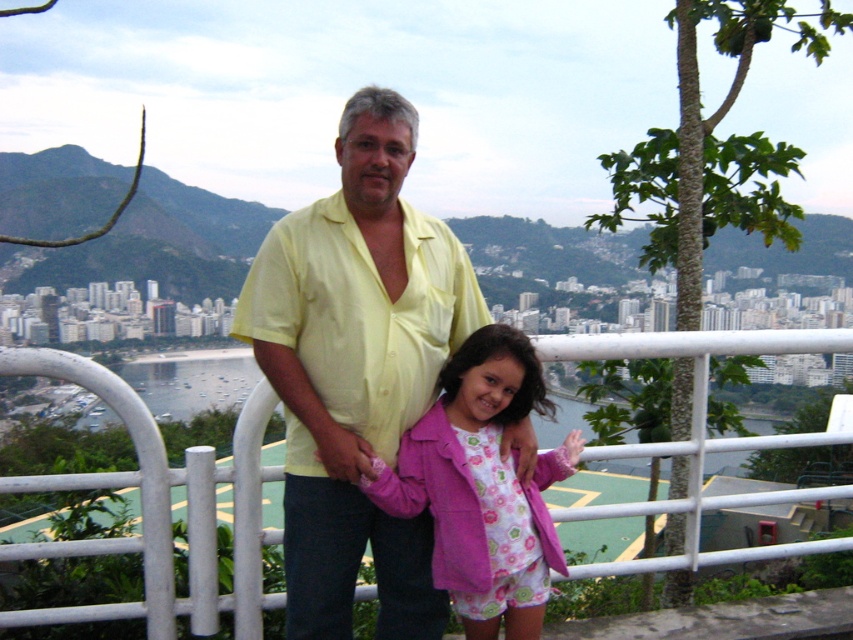
Question: Which object is farther from the camera taking this photo?

Choices:
 (A) white metal fence at center
 (B) pink fabric jacket at center

Answer: (B)

Question: Is yellow smooth shirt at center above white metal fence at center?

Choices:
 (A) no
 (B) yes

Answer: (B)

Question: Is white metal fence at center to the right of pink fabric jacket at center from the viewer's perspective?

Choices:
 (A) yes
 (B) no

Answer: (B)

Question: Which object appears closest to the camera in this image?

Choices:
 (A) pink fabric jacket at center
 (B) white metal fence at center
 (C) yellow smooth shirt at center

Answer: (B)

Question: Is yellow smooth shirt at center thinner than white metal fence at center?

Choices:
 (A) yes
 (B) no

Answer: (A)

Question: Estimate the real-world distances between objects in this image. Which object is closer to the pink fabric jacket at center?

Choices:
 (A) yellow smooth shirt at center
 (B) white metal fence at center

Answer: (A)